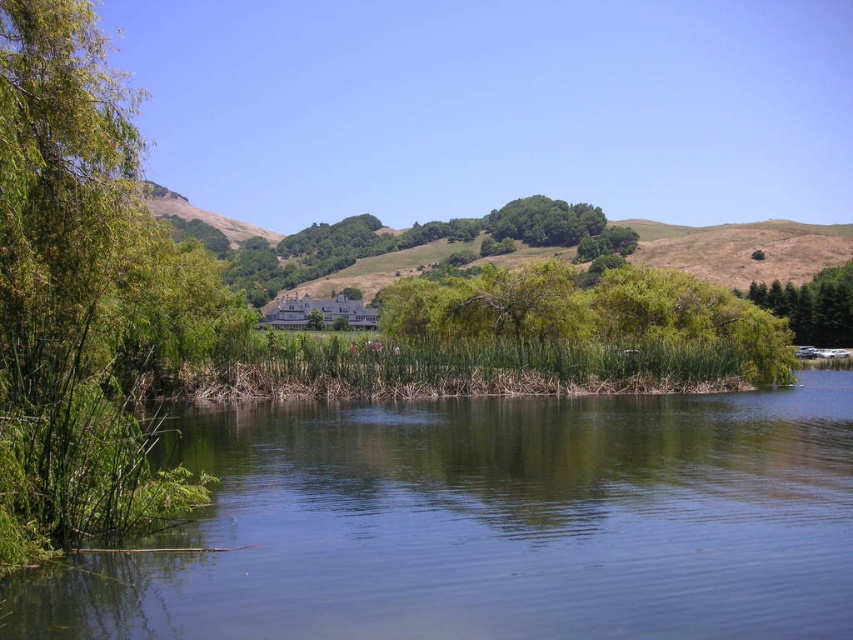
Which is more to the left, green grassy river at center or green leafy bush at center?

green grassy river at center is more to the left.

Which of these two, green grassy river at center or green leafy bush at center, stands shorter?

With less height is green grassy river at center.

At what (x,y) coordinates should I click in order to perform the action: click on green grassy river at center. Please return your answer as a coordinate pair (x, y). This screenshot has height=640, width=853. Looking at the image, I should click on (490, 524).

The width and height of the screenshot is (853, 640). I want to click on green grassy river at center, so click(490, 524).

Is green grassy river at center closer to camera compared to green leafy tree at left?

Yes, green grassy river at center is in front of green leafy tree at left.

Is point (502, 602) positioned after point (160, 365)?

No, it is in front of (160, 365).

Locate an element on the screen. The height and width of the screenshot is (640, 853). green grassy river at center is located at coordinates (490, 524).

From the picture: Is green leafy tree at left bigger than green leafy bush at center?

No.

Who is more distant from viewer, (41, 0) or (624, 316)?

Point (624, 316)

Is point (152, 381) closer to camera compared to point (633, 308)?

Yes.

Locate an element on the screen. green leafy tree at left is located at coordinates (86, 296).